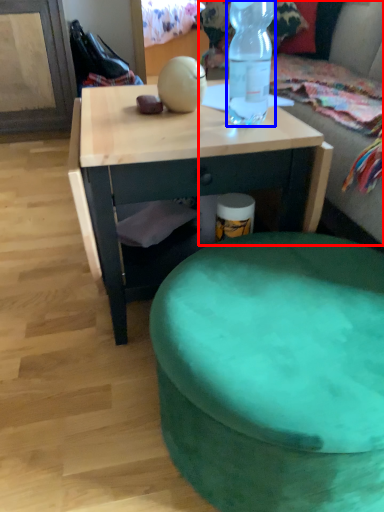
Question: Among these objects, which one is nearest to the camera, bean bag chair (highlighted by a red box) or bottle (highlighted by a blue box)?

Choices:
 (A) bean bag chair
 (B) bottle

Answer: (B)